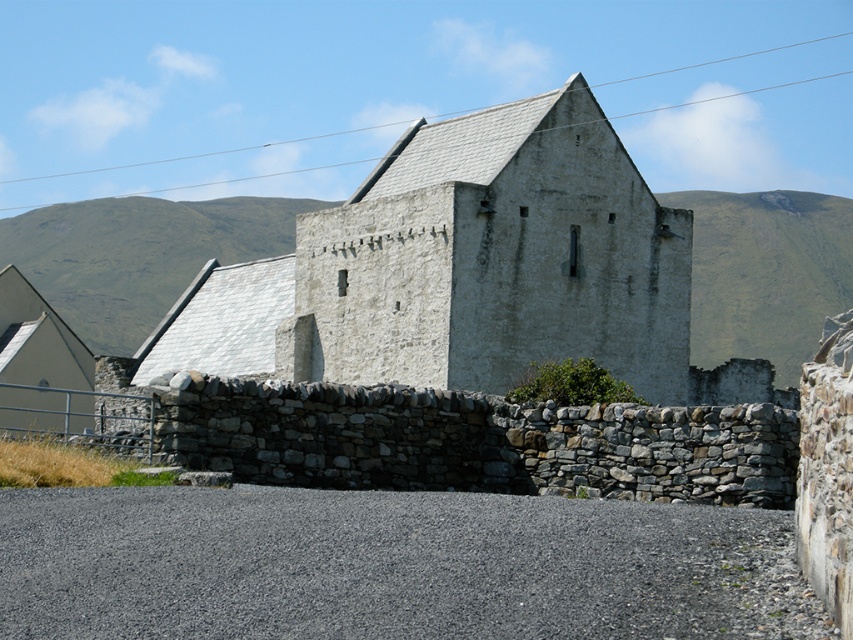
Question: Is white stone chapel at center wider than green grassy hillside at upper left?

Choices:
 (A) yes
 (B) no

Answer: (B)

Question: Does white stone chapel at center appear on the left side of green grassy hillside at upper left?

Choices:
 (A) no
 (B) yes

Answer: (A)

Question: Does white stone chapel at center appear on the left side of green grassy hillside at upper left?

Choices:
 (A) yes
 (B) no

Answer: (B)